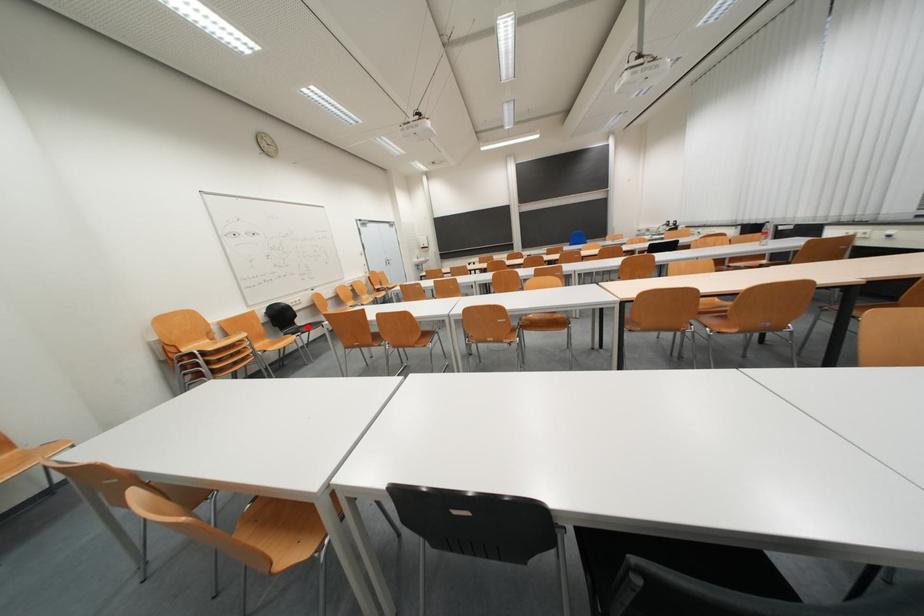
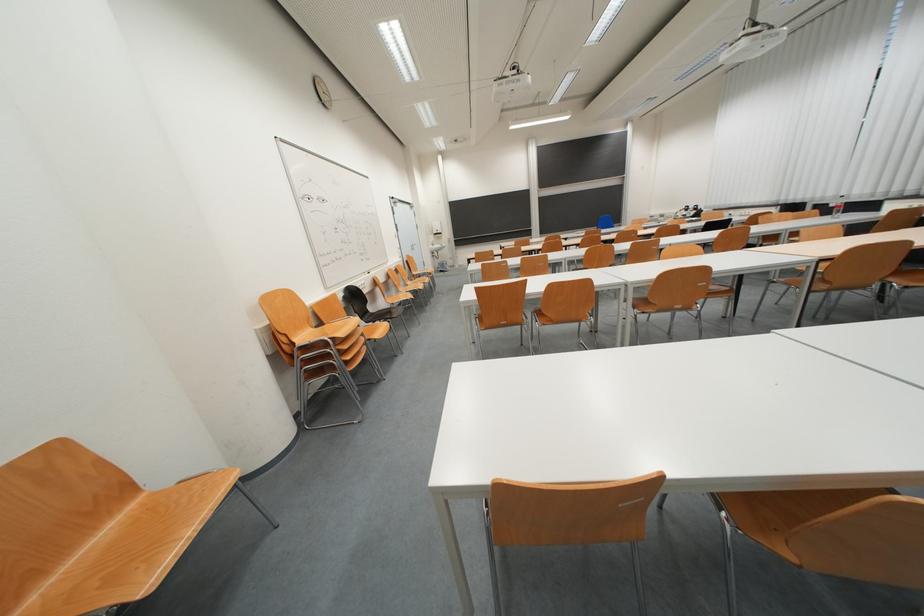
In the second image, find the point that corresponds to the highlighted location in the first image.

(379, 313)